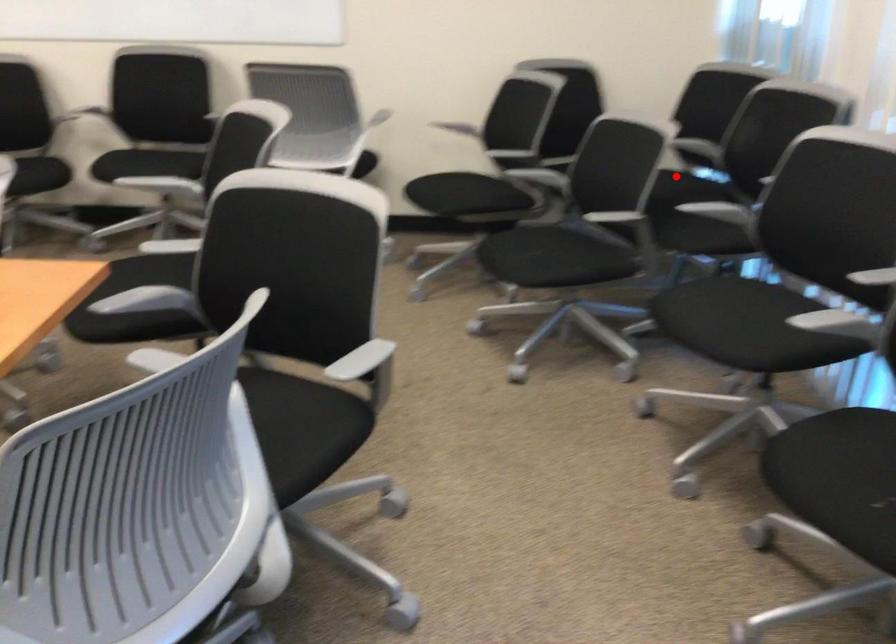
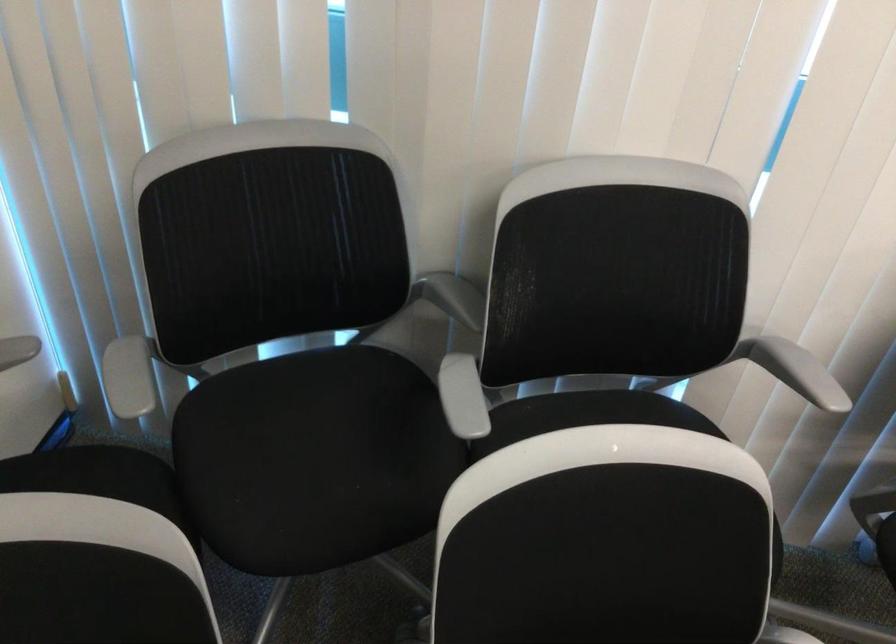
Question: I am providing you with two images of the same scene from different viewpoints. In image1, a red point is highlighted. Considering the same 3D point in image2, which of the following is correct?

Choices:
 (A) It is closer
 (B) It is farther

Answer: (A)